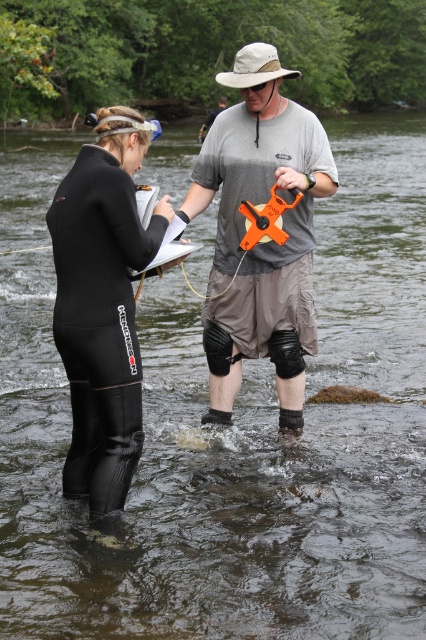
Question: Which of the following is the closest to the observer?

Choices:
 (A) (118, 433)
 (B) (259, 150)

Answer: (A)

Question: Does gray fabric shirt at center have a larger size compared to black neoprene wetsuit at left?

Choices:
 (A) no
 (B) yes

Answer: (B)

Question: Considering the relative positions of gray fabric shirt at center and black neoprene wetsuit at left in the image provided, where is gray fabric shirt at center located with respect to black neoprene wetsuit at left?

Choices:
 (A) left
 (B) right

Answer: (B)

Question: Which point is closer to the camera?

Choices:
 (A) (132, 356)
 (B) (305, 212)

Answer: (A)

Question: Can you confirm if gray fabric shirt at center is bigger than black neoprene wetsuit at left?

Choices:
 (A) no
 (B) yes

Answer: (B)